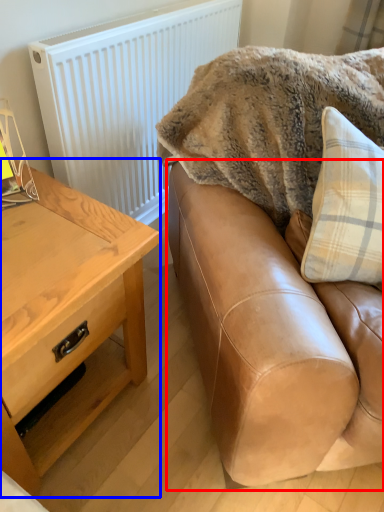
Question: Which object appears farthest to the camera in this image, studio couch (highlighted by a red box) or table (highlighted by a blue box)?

Choices:
 (A) studio couch
 (B) table

Answer: (B)